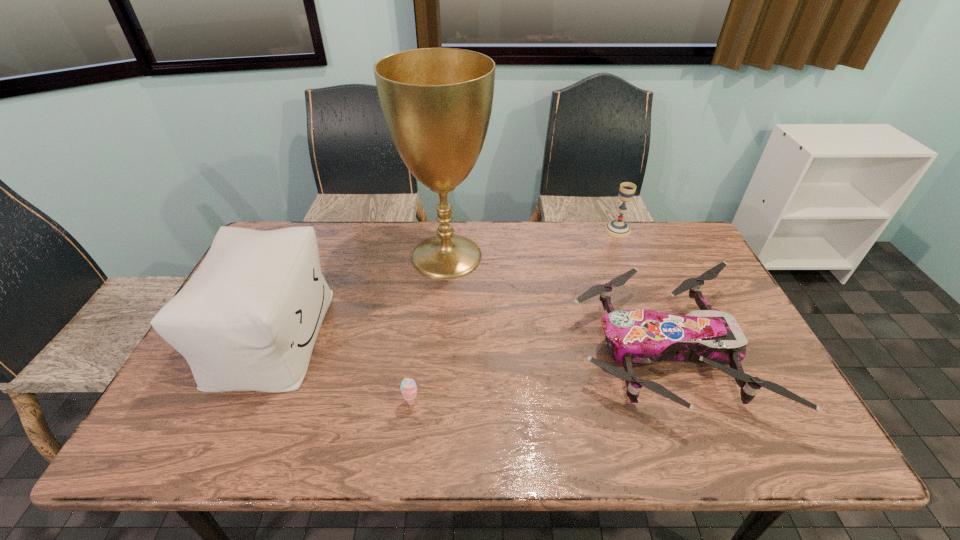
Locate an element on the screen. blank space that satisfies the following two spatial constraints: 1. on the front-facing side of the brown radio receiver; 2. on the front side of the blue pottery is located at coordinates (757, 389).